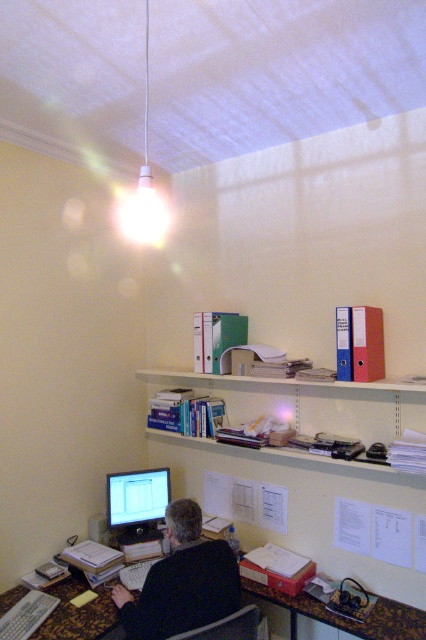
Does black fabric person at lower center have a lesser width compared to dark gray fabric chair at lower center?

No.

Does black fabric person at lower center have a larger size compared to dark gray fabric chair at lower center?

Correct, black fabric person at lower center is larger in size than dark gray fabric chair at lower center.

Between point (167, 627) and point (245, 627), which one is positioned in front?

Positioned in front is point (245, 627).

Locate an element on the screen. This screenshot has width=426, height=640. black fabric person at lower center is located at coordinates (181, 580).

Can you confirm if brown wood table at lower center is wider than matte black monitor at lower center?

Indeed, brown wood table at lower center has a greater width compared to matte black monitor at lower center.

Between brown wood table at lower center and matte black monitor at lower center, which one is positioned lower?

Positioned lower is brown wood table at lower center.

This screenshot has height=640, width=426. What do you see at coordinates (365, 620) in the screenshot?
I see `brown wood table at lower center` at bounding box center [365, 620].

I want to click on brown wood table at lower center, so click(365, 620).

Which of these two, black fabric person at lower center or white matte lamp at upper center, stands shorter?

white matte lamp at upper center

Can you confirm if black fabric person at lower center is bigger than white matte lamp at upper center?

No, black fabric person at lower center is not bigger than white matte lamp at upper center.

Is point (169, 600) positioned in front of point (152, 230)?

Yes.

Locate an element on the screen. black fabric person at lower center is located at coordinates (181, 580).